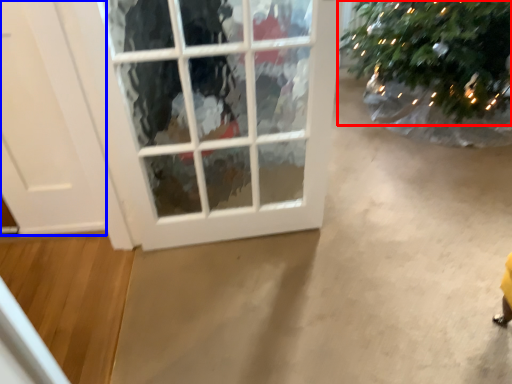
Question: Which of the following is the farthest to the observer, christmas tree (highlighted by a red box) or door (highlighted by a blue box)?

Choices:
 (A) christmas tree
 (B) door

Answer: (A)